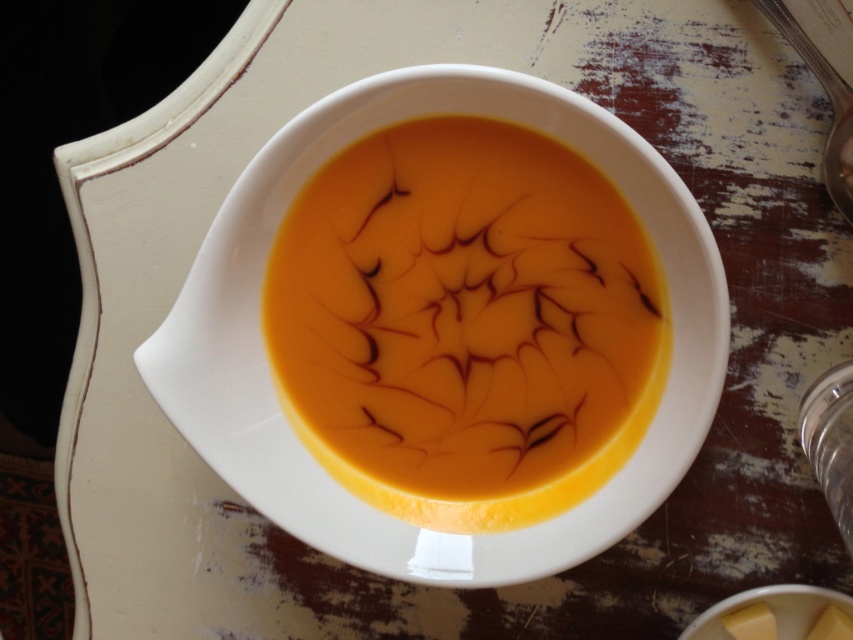
You are a chef preparing a dish and need to place a garnish on the orange smoothie at center. The garnish must be placed near the metallic silver spoon at upper right. Based on the scene, can you determine if the spoon is positioned in a way that allows easy access to the smoothie for garnishing?

The orange smoothie at center is in front of the metallic silver spoon at upper right, meaning the spoon is behind the smoothie. To garnish the smoothie, you would need to move the spoon out of the way first.